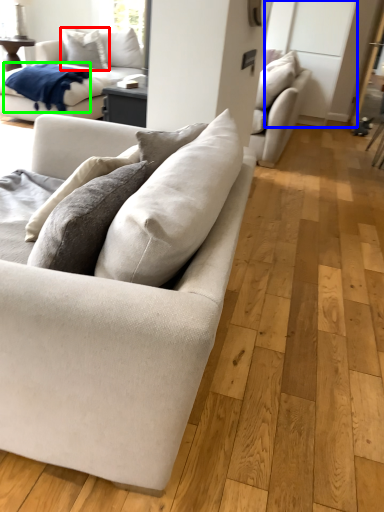
Question: Estimate the real-world distances between objects in this image. Which object is closer to pillow (highlighted by a red box), glass door (highlighted by a blue box) or blanket (highlighted by a green box)?

Choices:
 (A) glass door
 (B) blanket

Answer: (B)